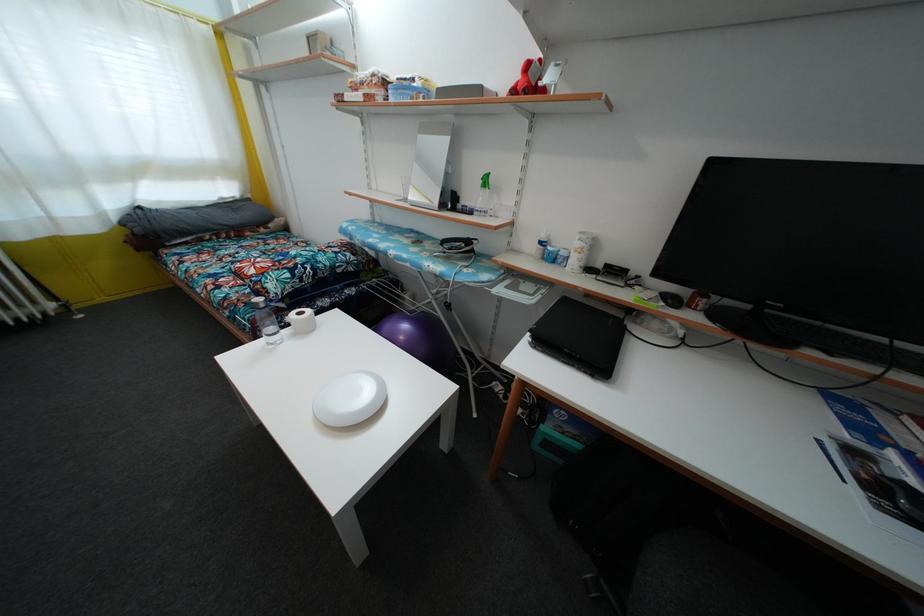
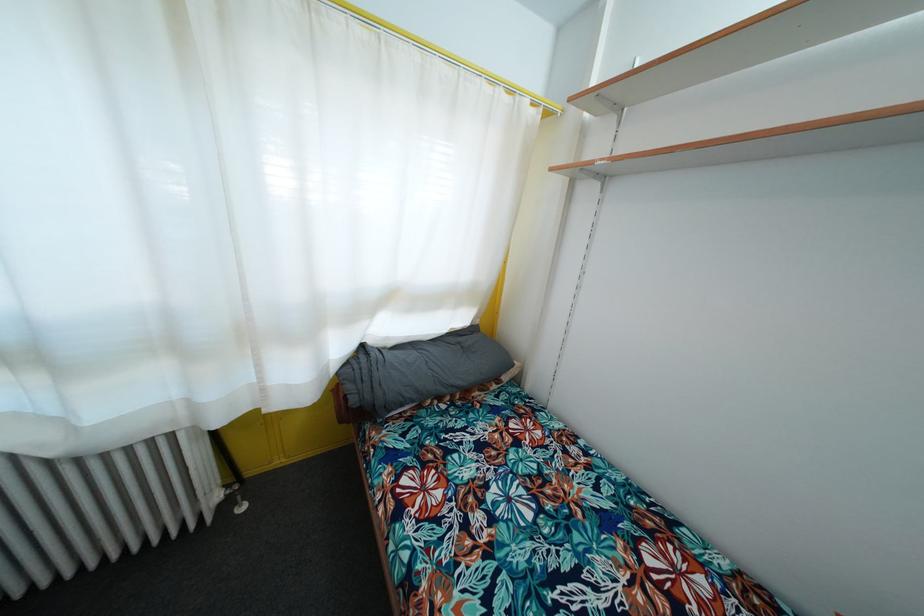
In the scene shown: In a continuous first-person perspective shot, in which direction is the camera moving?

The cameraman walked toward left, forward.